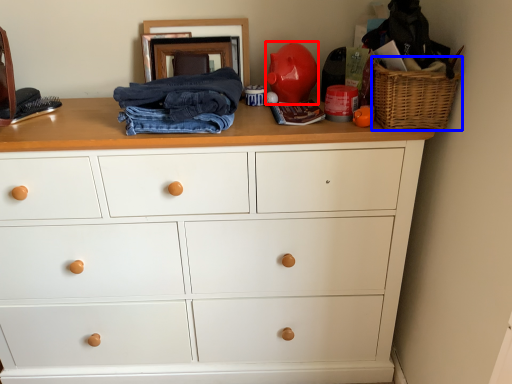
Question: Among these objects, which one is farthest to the camera, toy (highlighted by a red box) or basket (highlighted by a blue box)?

Choices:
 (A) toy
 (B) basket

Answer: (A)